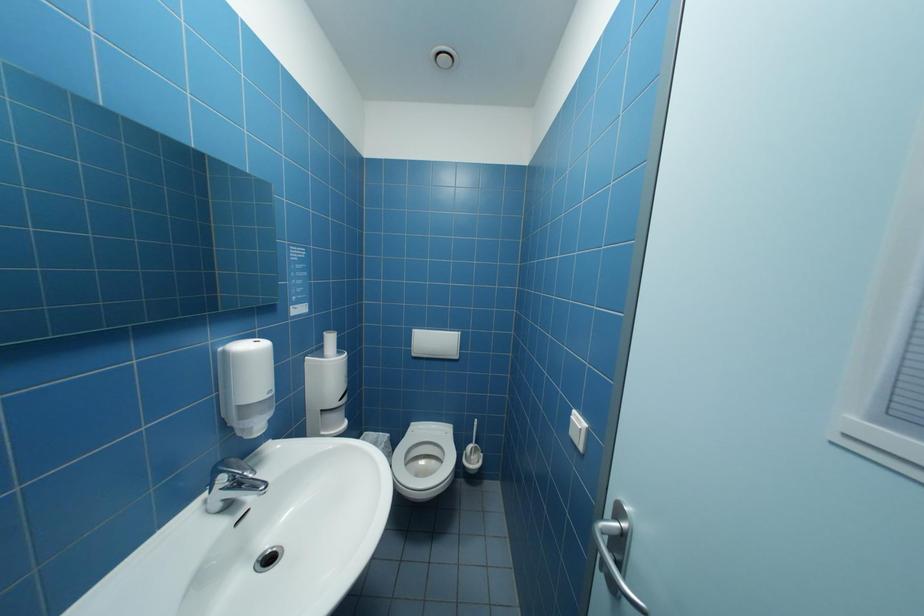
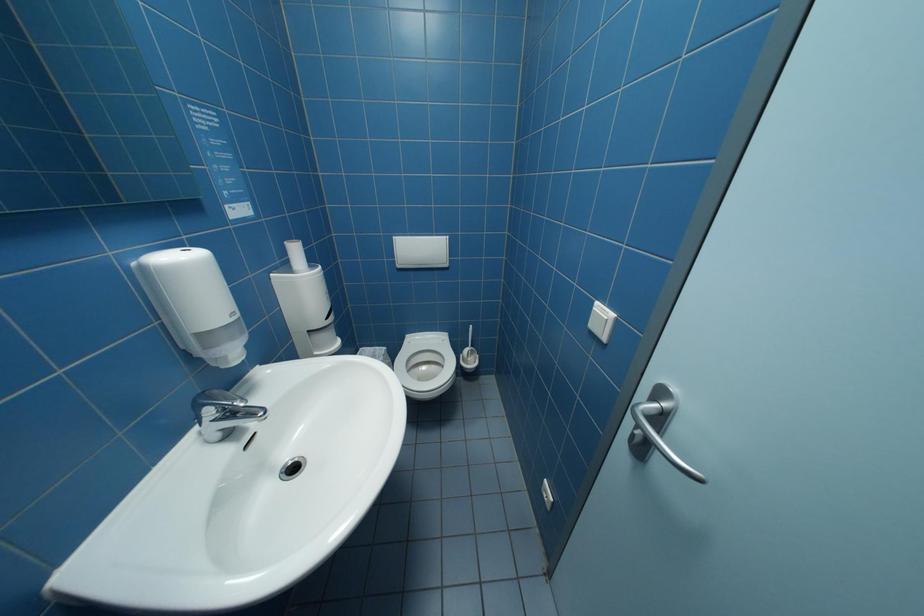
The images are taken continuously from a first-person perspective. In which direction are you moving?

The movement direction of the cameraman is left, forward.